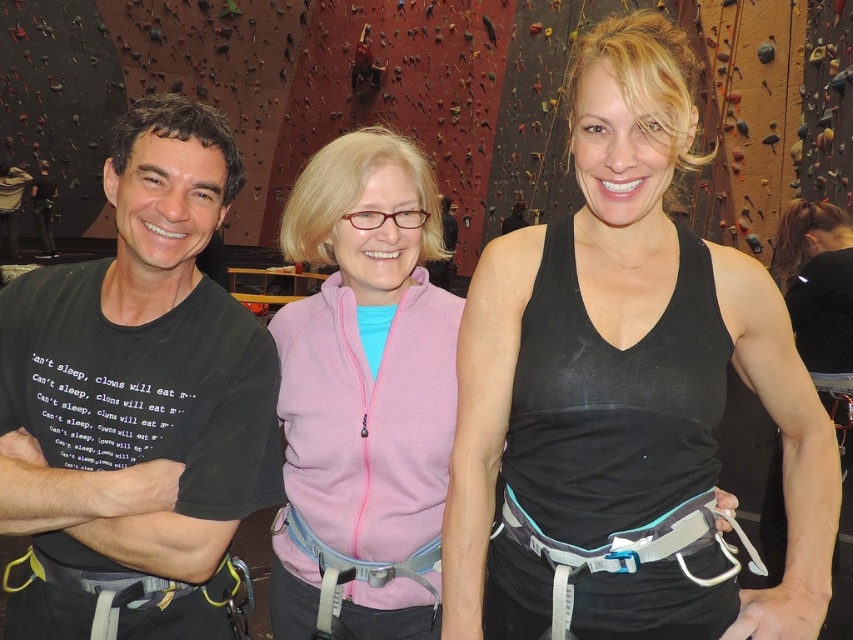
Question: Observing the image, what is the correct spatial positioning of black matte t-shirt at left in reference to black t-shirt at left?

Choices:
 (A) above
 (B) below

Answer: (B)

Question: Estimate the real-world distances between objects in this image. Which object is closer to the black matte tank top at center?

Choices:
 (A) black t-shirt at left
 (B) black matte t-shirt at left
 (C) pink fleece jacket at center

Answer: (C)

Question: Based on their relative distances, which object is farther from the black matte t-shirt at left?

Choices:
 (A) black matte tank top at center
 (B) black t-shirt at left

Answer: (B)

Question: Considering the real-world distances, which object is farthest from the pink fleece jacket at center?

Choices:
 (A) black matte t-shirt at left
 (B) black matte tank top at center

Answer: (B)

Question: Is the position of black matte tank top at center more distant than that of black matte t-shirt at left?

Choices:
 (A) yes
 (B) no

Answer: (B)

Question: Does black matte t-shirt at left have a larger size compared to pink fleece jacket at center?

Choices:
 (A) no
 (B) yes

Answer: (B)